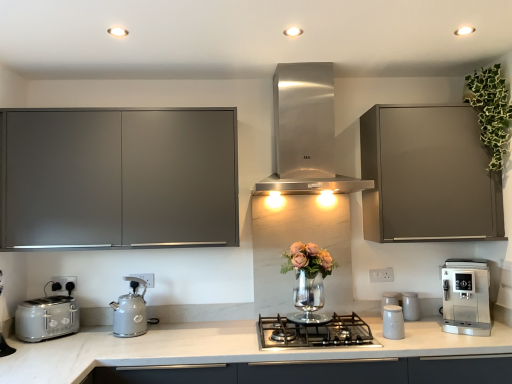
Question: Is stainless steel gas stove at center positioned beyond the bounds of white plastic electric outlet at lower center, which is the second electric outlet from front to back?

Choices:
 (A) yes
 (B) no

Answer: (A)

Question: Is stainless steel gas stove at center directly adjacent to white plastic electric outlet at lower center, which is the second electric outlet from front to back?

Choices:
 (A) yes
 (B) no

Answer: (B)

Question: Considering the relative sizes of stainless steel gas stove at center and white plastic electric outlet at lower center, which is the 1th electric outlet in left-to-right order, in the image provided, is stainless steel gas stove at center smaller than white plastic electric outlet at lower center, which is the 1th electric outlet in left-to-right order,?

Choices:
 (A) yes
 (B) no

Answer: (B)

Question: Considering the relative sizes of stainless steel gas stove at center and white plastic electric outlet at lower center, the second electric outlet viewed from the back, in the image provided, is stainless steel gas stove at center shorter than white plastic electric outlet at lower center, the second electric outlet viewed from the back,?

Choices:
 (A) no
 (B) yes

Answer: (B)

Question: From the image's perspective, is stainless steel gas stove at center on top of white plastic electric outlet at lower center, which is the second electric outlet from front to back?

Choices:
 (A) no
 (B) yes

Answer: (A)

Question: Considering the positions of satin silver toaster at left and stainless steel gas stove at center in the image, is satin silver toaster at left taller or shorter than stainless steel gas stove at center?

Choices:
 (A) short
 (B) tall

Answer: (B)

Question: From the image's perspective, is satin silver toaster at left above or below stainless steel gas stove at center?

Choices:
 (A) above
 (B) below

Answer: (A)

Question: Considering their positions, is satin silver toaster at left located in front of or behind stainless steel gas stove at center?

Choices:
 (A) behind
 (B) front

Answer: (A)

Question: Which is correct: satin silver toaster at left is inside stainless steel gas stove at center, or outside of it?

Choices:
 (A) inside
 (B) outside

Answer: (B)

Question: Considering their positions, is white ceramic canisters at center-right, the fourth kitchen appliance positioned from the front, located in front of or behind matte gray cabinet at upper right, which ranks as the second cabinetry in left-to-right order?

Choices:
 (A) behind
 (B) front

Answer: (A)

Question: Is white ceramic canisters at center-right, the fourth kitchen appliance positioned from the front, bigger or smaller than matte gray cabinet at upper right, acting as the 1th cabinetry starting from the right?

Choices:
 (A) small
 (B) big

Answer: (A)

Question: Would you say white ceramic canisters at center-right, arranged as the 1th kitchen appliance when viewed from the back, is to the left or to the right of matte gray cabinet at upper right, acting as the 1th cabinetry starting from the right, in the picture?

Choices:
 (A) right
 (B) left

Answer: (B)

Question: From the image's perspective, relative to matte gray cabinet at upper right, acting as the 1th cabinetry starting from the right, is white ceramic canisters at center-right, the fourth kitchen appliance positioned from the front, above or below?

Choices:
 (A) below
 (B) above

Answer: (A)

Question: From the image's perspective, is satin silver coffee machine at lower right, the 1th home appliance in the bottom-to-top sequence, above or below satin silver toaster at left?

Choices:
 (A) above
 (B) below

Answer: (A)

Question: From a real-world perspective, is satin silver coffee machine at lower right, the first home appliance viewed from the right, above or below satin silver toaster at left?

Choices:
 (A) above
 (B) below

Answer: (A)